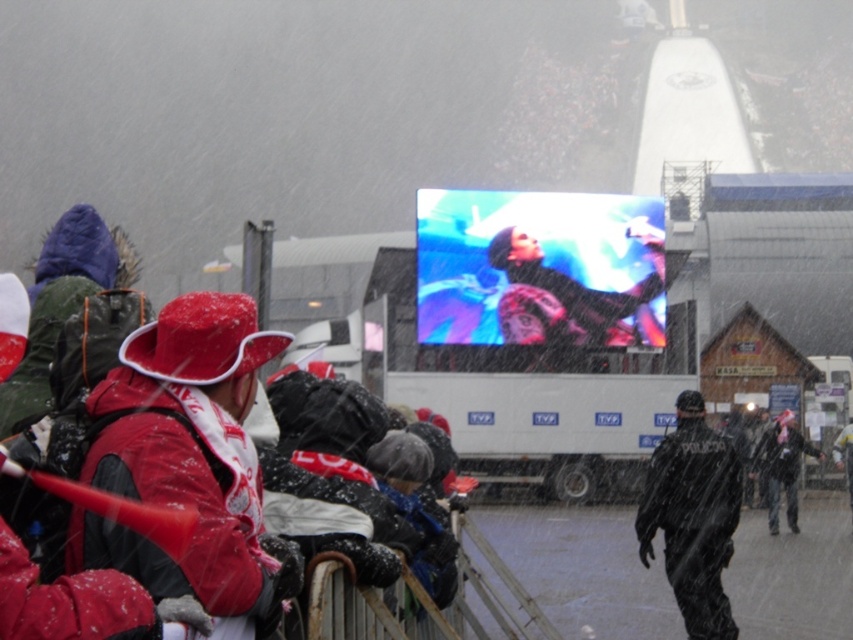
Which is more to the left, red matte hat at left or black uniformed officer at center?

red matte hat at left

Does red matte hat at left have a lesser height compared to black uniformed officer at center?

Indeed, red matte hat at left has a lesser height compared to black uniformed officer at center.

Between point (93, 532) and point (694, 600), which one is positioned behind?

Positioned behind is point (694, 600).

Where is `red matte hat at left`? This screenshot has width=853, height=640. red matte hat at left is located at coordinates (184, 454).

Can you confirm if black uniformed officer at center is wider than dark gray fabric jacket at center?

Yes.

Consider the image. Is black uniformed officer at center taller than dark gray fabric jacket at center?

Yes.

Who is more forward, (672,488) or (787,461)?

Point (672,488) is more forward.

Find the location of a particular element. black uniformed officer at center is located at coordinates (693, 516).

Between point (254, 532) and point (762, 440), which one is positioned behind?

The point (762, 440) is more distant.

Does point (223, 616) lie behind point (793, 420)?

No, it is in front of (793, 420).

The height and width of the screenshot is (640, 853). Find the location of `red matte hat at left`. red matte hat at left is located at coordinates (184, 454).